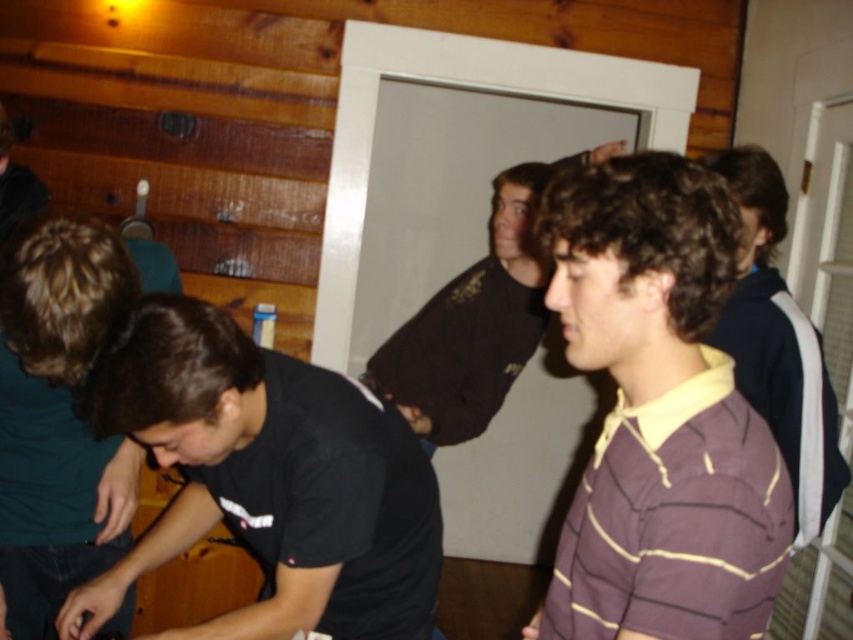
Between purple striped polo shirt at center and dark brown leather jacket at center, which one is positioned higher?

dark brown leather jacket at center is higher up.

This screenshot has width=853, height=640. I want to click on purple striped polo shirt at center, so click(x=659, y=413).

Does black matte shirt at lower left have a greater width compared to dark brown leather jacket at center?

In fact, black matte shirt at lower left might be narrower than dark brown leather jacket at center.

Looking at this image, does black matte shirt at lower left appear under dark brown leather jacket at center?

Yes, black matte shirt at lower left is below dark brown leather jacket at center.

Image resolution: width=853 pixels, height=640 pixels. What are the coordinates of `black matte shirt at lower left` in the screenshot? It's located at (267, 480).

Between black matte shirt at lower left and purple striped polo shirt at right, which one is positioned lower?

Positioned lower is black matte shirt at lower left.

Does black matte shirt at lower left appear on the right side of purple striped polo shirt at right?

No, black matte shirt at lower left is not to the right of purple striped polo shirt at right.

Describe the element at coordinates (267, 480) in the screenshot. I see `black matte shirt at lower left` at that location.

Identify the location of black matte shirt at lower left. The image size is (853, 640). (267, 480).